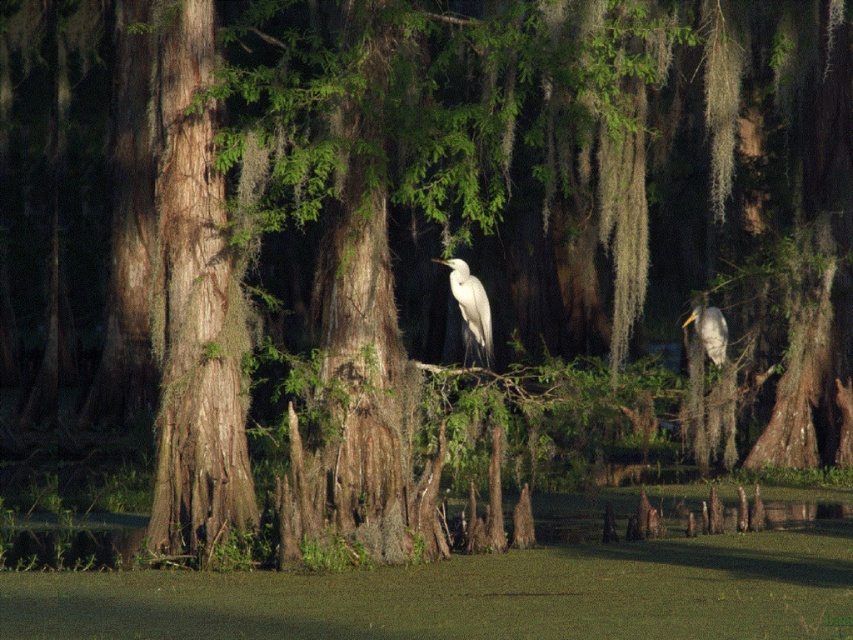
You are an ornithologist observing two birds in the swampy area. You notice a white smooth bird at center and a white matte bird at right. Which bird is taller?

The white smooth bird at center is much taller than the white matte bird at right.

In the scene shown: You are standing at the edge of the swampy area shown in the image. You see a point marked at coordinates (471, 312). What object is located at that point?

The point at coordinates (471, 312) marks the location of a white smooth bird at center.

You are a photographer standing at the edge of the swamp. You want to capture a photo of the white smooth bird at center. Where should you aim your camera to get the best shot?

The white smooth bird at center is located at coordinates approximately 0.489 on the x axis and 0.553 on the y axis, so aim your camera towards that point for the best shot.